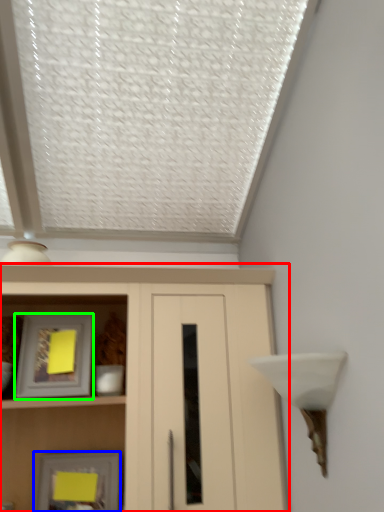
Question: Which is nearer to the cupboard (highlighted by a red box)? picture frame (highlighted by a blue box) or picture frame (highlighted by a green box).

Choices:
 (A) picture frame
 (B) picture frame

Answer: (B)